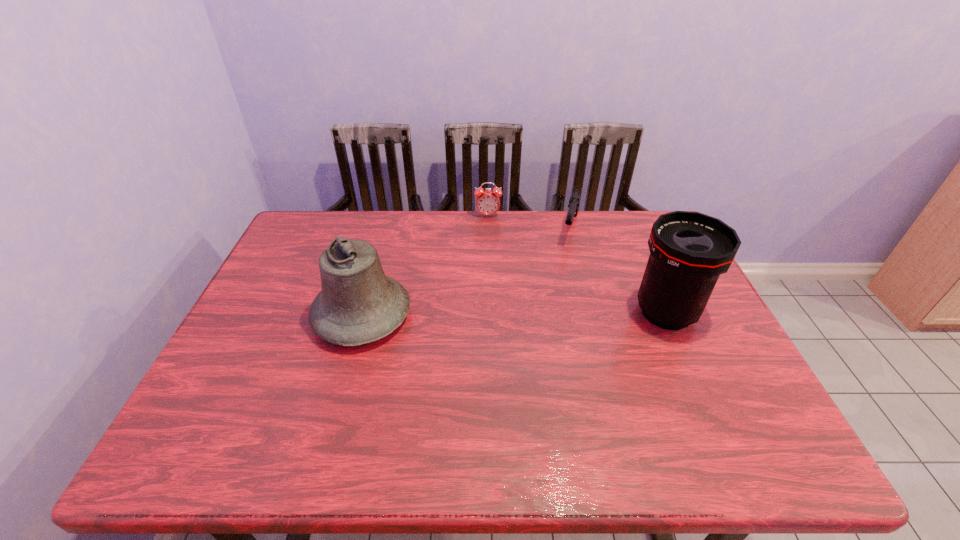
Image resolution: width=960 pixels, height=540 pixels. I want to click on empty location between the rightmost object and the second object from left to right, so click(577, 264).

Locate an element on the screen. This screenshot has height=540, width=960. the closest object to the alarm clock is located at coordinates (575, 198).

Point out which object is positioned as the nearest to the third object from left to right. Please provide its 2D coordinates. Your answer should be formatted as a tuple, i.e. [(x, y)], where the tuple contains the x and y coordinates of a point satisfying the conditions above.

[(487, 202)]

Find the location of a particular element. This screenshot has height=540, width=960. free spot that satisfies the following two spatial constraints: 1. on the front side of the gun; 2. on the left side of the alarm clock is located at coordinates (488, 229).

The width and height of the screenshot is (960, 540). In order to click on vacant space that satisfies the following two spatial constraints: 1. on the front side of the gun; 2. on the left side of the alarm clock in this screenshot , I will do `click(488, 229)`.

Identify the location of vacant area that satisfies the following two spatial constraints: 1. on the front side of the telephoto lens; 2. on the left side of the alarm clock. [x=491, y=313].

Where is `free space that satisfies the following two spatial constraints: 1. on the back side of the gun; 2. on the left side of the bell`? The image size is (960, 540). free space that satisfies the following two spatial constraints: 1. on the back side of the gun; 2. on the left side of the bell is located at coordinates (386, 229).